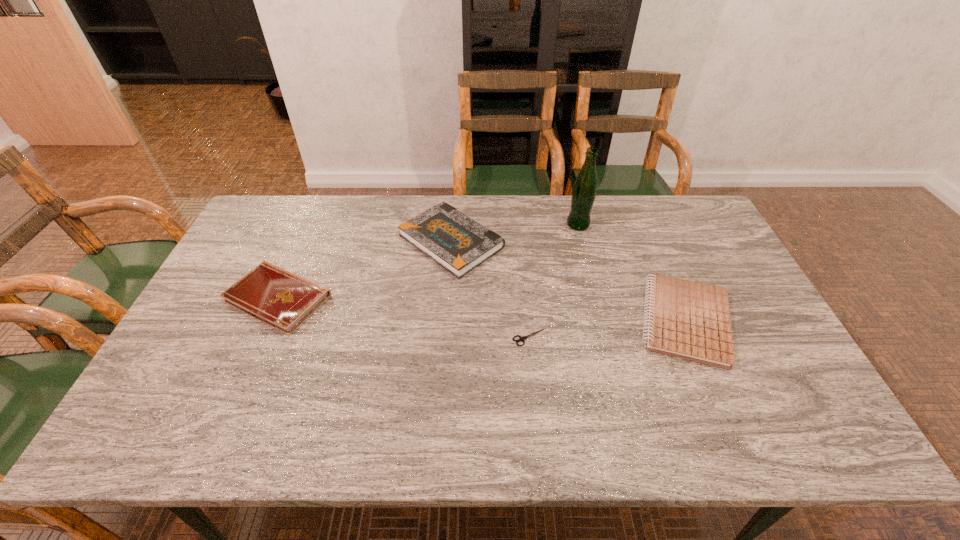
This screenshot has height=540, width=960. Find the location of `blank area located 0.300m on the left of the rightmost object`. blank area located 0.300m on the left of the rightmost object is located at coordinates (525, 321).

The height and width of the screenshot is (540, 960). What are the coordinates of `vacant area located on the front of the leftmost object` in the screenshot? It's located at (220, 431).

Locate an element on the screen. vacant space located on the left of the shortest object is located at coordinates coord(493,337).

Identify the location of beer bottle that is at the far edge. (583, 195).

This screenshot has width=960, height=540. Identify the location of notebook that is at the far edge. (459, 244).

Where is `object located in the left edge section of the desktop`? The height and width of the screenshot is (540, 960). object located in the left edge section of the desktop is located at coordinates (270, 294).

At what (x,y) coordinates should I click in order to perform the action: click on object that is at the right edge. Please return your answer as a coordinate pair (x, y). The width and height of the screenshot is (960, 540). Looking at the image, I should click on (690, 320).

Locate an element on the screen. This screenshot has height=540, width=960. vacant space at the far edge of the desktop is located at coordinates (321, 222).

Image resolution: width=960 pixels, height=540 pixels. Find the location of `vacant point at the near edge`. vacant point at the near edge is located at coordinates (401, 434).

What are the coordinates of `free region at the left edge` in the screenshot? It's located at (244, 272).